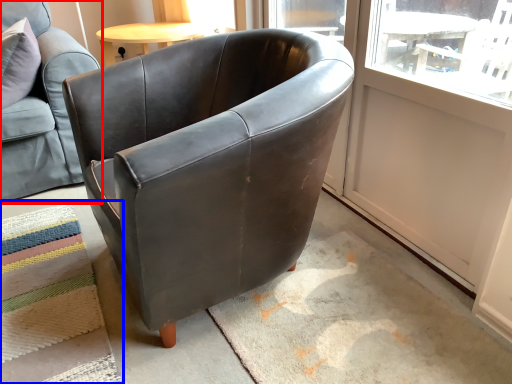
Question: Which of the following is the closest to the observer, chair (highlighted by a red box) or mat (highlighted by a blue box)?

Choices:
 (A) chair
 (B) mat

Answer: (B)